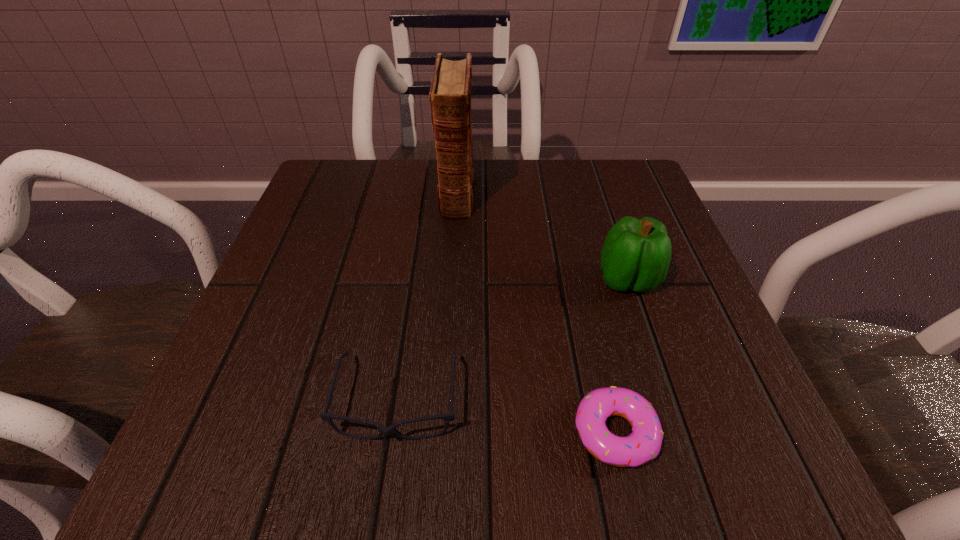
At what (x,y) coordinates should I click in order to perform the action: click on spectacles that is positioned at the near edge. Please return your answer as a coordinate pair (x, y). This screenshot has height=540, width=960. Looking at the image, I should click on (450, 416).

Locate an element on the screen. doughnut positioned at the near edge is located at coordinates (644, 443).

The width and height of the screenshot is (960, 540). I want to click on bell pepper that is at the right edge, so click(x=636, y=254).

Identify the location of doughnut that is at the right edge. (644, 443).

This screenshot has width=960, height=540. Find the location of `object present at the near right corner`. object present at the near right corner is located at coordinates (644, 443).

You are a GUI agent. You are given a task and a screenshot of the screen. Output one action in this format:
    pyautogui.click(x=<x>, y=<y>)
    Task: Click on the free space at the far edge of the desktop
    Image resolution: width=960 pixels, height=540 pixels.
    Given the screenshot: What is the action you would take?
    pyautogui.click(x=505, y=178)

Find the location of a particular element. free space at the near edge of the desktop is located at coordinates (503, 453).

In the image, there is a desktop. Where is `free space at the left edge`? free space at the left edge is located at coordinates (300, 374).

What are the coordinates of `vacant space at the right edge` in the screenshot? It's located at (688, 333).

Find the location of a particular element. The width and height of the screenshot is (960, 540). free space at the far left corner of the desktop is located at coordinates (319, 174).